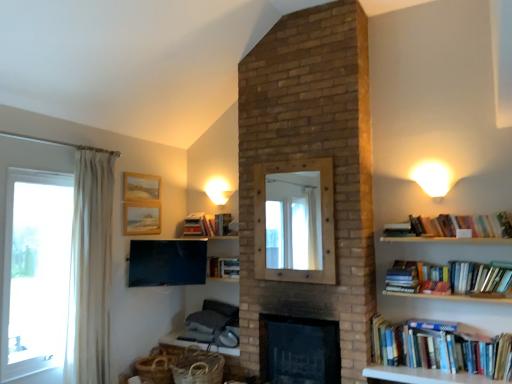
Question: Can you confirm if wooden mirror at center is wider than white fabric curtain at left?

Choices:
 (A) yes
 (B) no

Answer: (B)

Question: Are wooden mirror at center and white fabric curtain at left located far from each other?

Choices:
 (A) yes
 (B) no

Answer: (A)

Question: From the image's perspective, would you say wooden mirror at center is shown under white fabric curtain at left?

Choices:
 (A) yes
 (B) no

Answer: (B)

Question: Is wooden mirror at center positioned beyond the bounds of white fabric curtain at left?

Choices:
 (A) yes
 (B) no

Answer: (A)

Question: Is wooden mirror at center shorter than white fabric curtain at left?

Choices:
 (A) no
 (B) yes

Answer: (B)

Question: Is point (192, 225) positioned closer to the camera than point (124, 198)?

Choices:
 (A) farther
 (B) closer

Answer: (A)

Question: Relative to wooden picture frame at upper left, marked as the 1th picture frame in a top-to-bottom arrangement, is hardcover book at upper center, which is the first book from back to front, in front or behind?

Choices:
 (A) front
 (B) behind

Answer: (B)

Question: Is hardcover book at upper center, which is the first book from back to front, inside or outside of wooden picture frame at upper left, marked as the 1th picture frame in a top-to-bottom arrangement?

Choices:
 (A) inside
 (B) outside

Answer: (B)

Question: From the image's perspective, relative to wooden picture frame at upper left, positioned as the 2th picture frame in bottom-to-top order, is hardcover book at upper center, the first book in the left-to-right sequence, above or below?

Choices:
 (A) below
 (B) above

Answer: (A)

Question: Is point (48, 221) closer or farther from the camera than point (128, 278)?

Choices:
 (A) farther
 (B) closer

Answer: (B)

Question: Choose the correct answer: Is clear glass window at left inside matte black tv at upper left or outside it?

Choices:
 (A) inside
 (B) outside

Answer: (B)

Question: In terms of width, does clear glass window at left look wider or thinner when compared to matte black tv at upper left?

Choices:
 (A) wide
 (B) thin

Answer: (A)

Question: Is clear glass window at left taller or shorter than matte black tv at upper left?

Choices:
 (A) short
 (B) tall

Answer: (B)

Question: Based on their sizes in the image, would you say white wood table at lower center is bigger or smaller than wooden mirror at center?

Choices:
 (A) big
 (B) small

Answer: (B)

Question: Is white wood table at lower center wider or thinner than wooden mirror at center?

Choices:
 (A) thin
 (B) wide

Answer: (B)